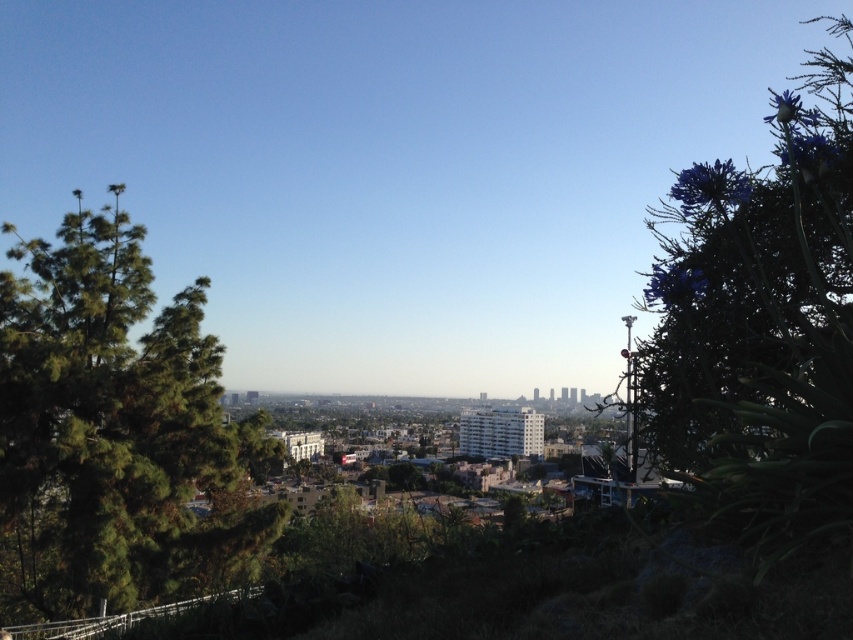
Who is taller, green leafy tree at left or purple leafy plant at right?

purple leafy plant at right

Looking at this image, is green leafy tree at left in front of purple leafy plant at right?

No, green leafy tree at left is behind purple leafy plant at right.

Who is more forward, (107,317) or (815,157)?

Positioned in front is point (815,157).

At what (x,y) coordinates should I click in order to perform the action: click on green leafy tree at left. Please return your answer as a coordinate pair (x, y). The width and height of the screenshot is (853, 640). Looking at the image, I should click on pos(112,428).